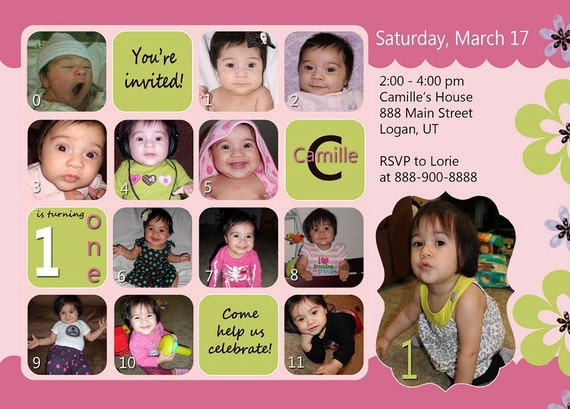
Find the location of a particular element. The image size is (570, 409). pink towel is located at coordinates (268, 163).